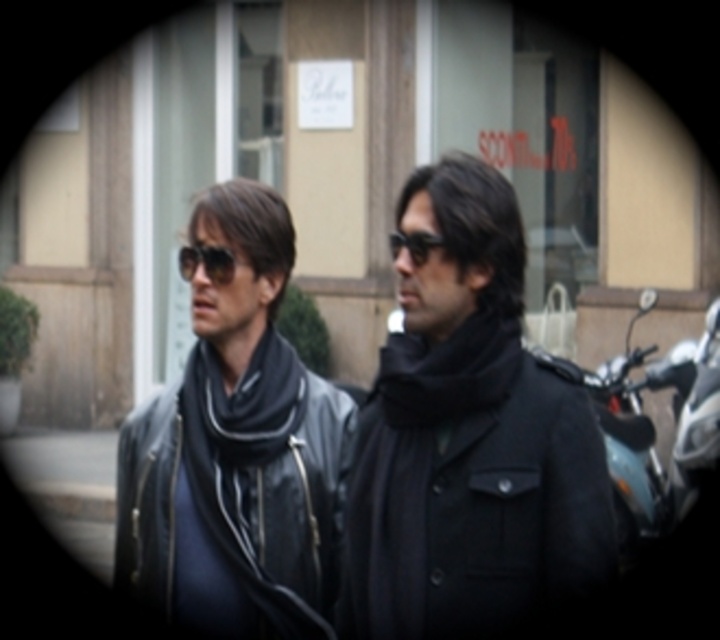
Does black leather jacket at center have a smaller size compared to matte black jacket at center?

No, black leather jacket at center is not smaller than matte black jacket at center.

Does point (181, 481) come farther from viewer compared to point (588, 536)?

Yes, point (181, 481) is farther from viewer.

Where is `black leather jacket at center`? The image size is (720, 640). black leather jacket at center is located at coordinates (364, 445).

Is black leather jacket at center further to camera compared to matte black sunglasses at center?

No.

Does black leather jacket at center appear under matte black sunglasses at center?

Indeed, black leather jacket at center is positioned under matte black sunglasses at center.

Who is more forward, (510,225) or (207,256)?

Point (510,225) is more forward.

At what (x,y) coordinates should I click in order to perform the action: click on black leather jacket at center. Please return your answer as a coordinate pair (x, y). The image size is (720, 640). Looking at the image, I should click on 364,445.

Who is more forward, (342, 486) or (212, 250)?

Point (212, 250) is in front.

What do you see at coordinates (235, 451) in the screenshot?
I see `black leather jacket at left` at bounding box center [235, 451].

Identify the location of black leather jacket at left. 235,451.